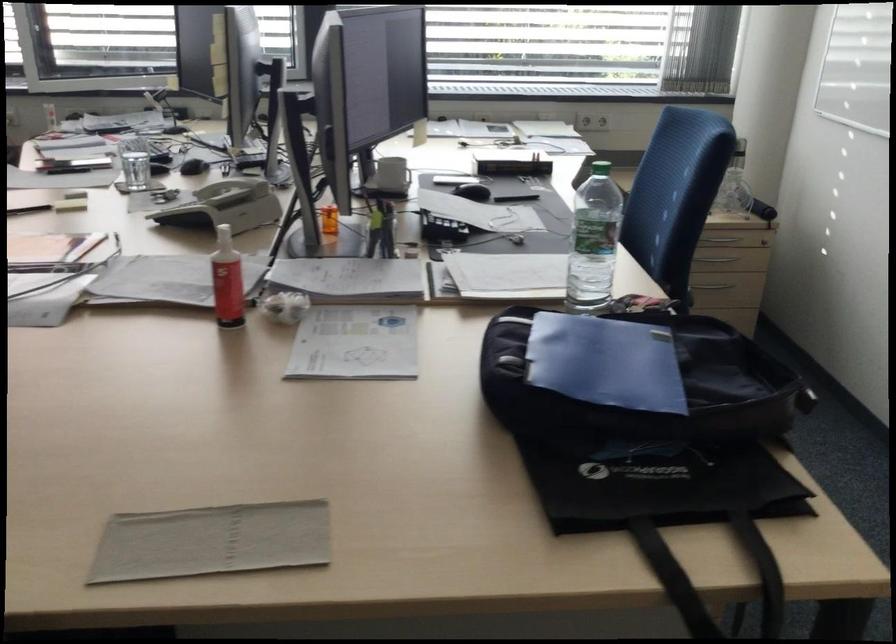
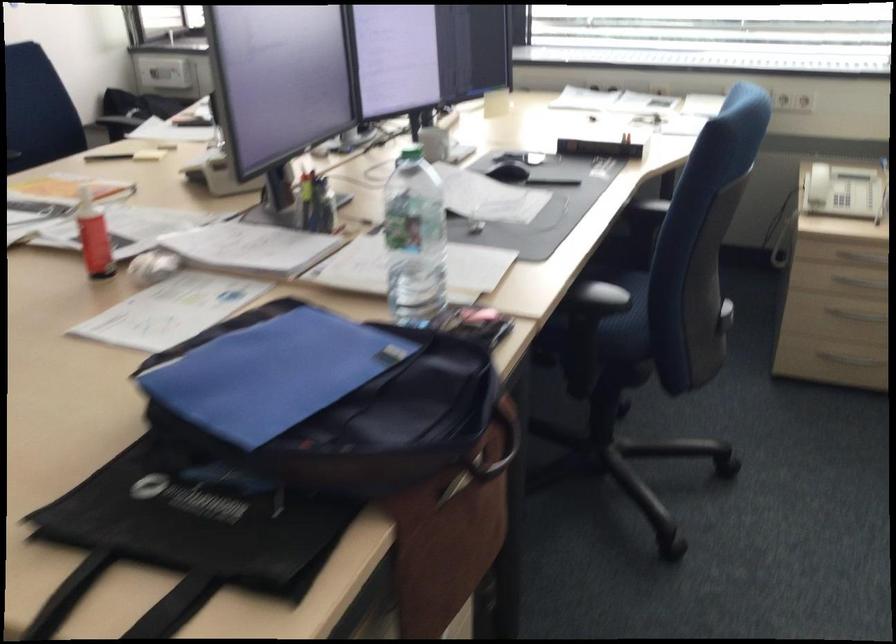
Locate, in the second image, the point that corresponds to (x=605, y=240) in the first image.

(415, 240)